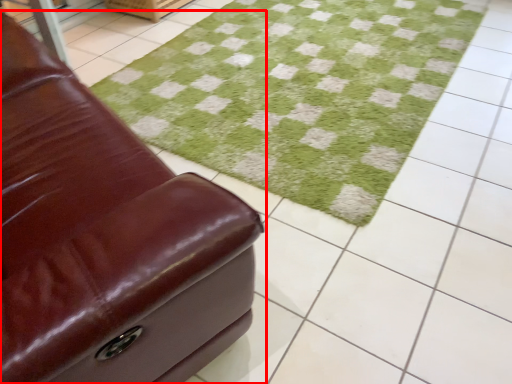
Question: From the image's perspective, where is furniture (annotated by the red box) located relative to grass?

Choices:
 (A) below
 (B) above

Answer: (A)